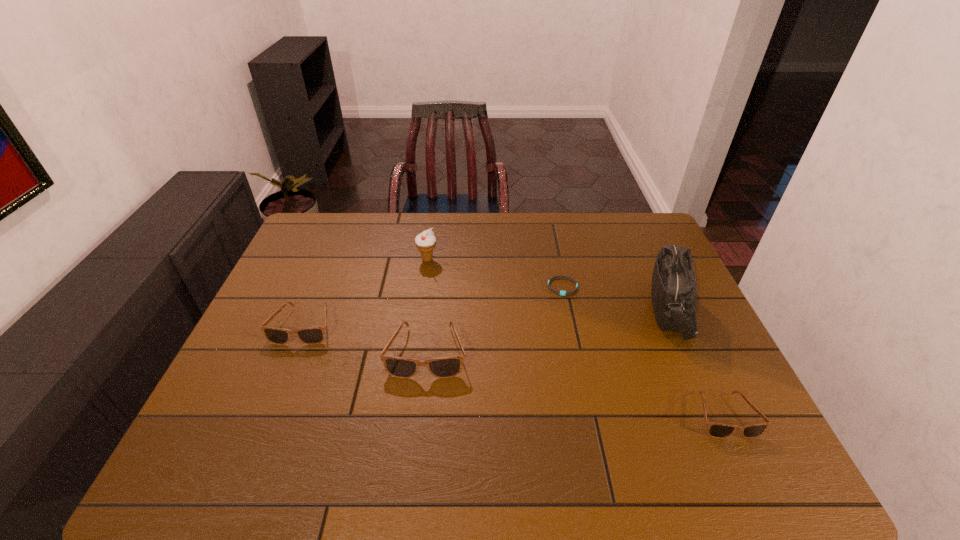
Find the location of a particular element. the second tallest sunglasses is located at coordinates (314, 335).

The image size is (960, 540). Identify the location of the leftmost object. (314, 335).

You are a GUI agent. You are given a task and a screenshot of the screen. Output one action in this format:
    pyautogui.click(x=<x>, y=<y>)
    Task: Click on the third tallest object
    The image size is (960, 540).
    Given the screenshot: What is the action you would take?
    pyautogui.click(x=446, y=367)

Image resolution: width=960 pixels, height=540 pixels. Identify the location of the tallest sunglasses. (x=446, y=367).

You are a GUI agent. You are given a task and a screenshot of the screen. Output one action in this format:
    pyautogui.click(x=<x>, y=<y>)
    Task: Click on the nearest object
    The height and width of the screenshot is (540, 960).
    Given the screenshot: What is the action you would take?
    pyautogui.click(x=716, y=430)

What are the coordinates of `the shortest sunglasses` in the screenshot? It's located at (716, 430).

Find the location of a particular element. the tallest object is located at coordinates [673, 289].

The height and width of the screenshot is (540, 960). Identify the location of the farthest object. (425, 242).

You are a GUI agent. You are given a task and a screenshot of the screen. Output one action in this format:
    pyautogui.click(x=<x>, y=<y>)
    Task: Click on the icecream
    This screenshot has height=540, width=960.
    Given the screenshot: What is the action you would take?
    pyautogui.click(x=425, y=242)

The image size is (960, 540). Find the location of `the shortest object`. the shortest object is located at coordinates (563, 293).